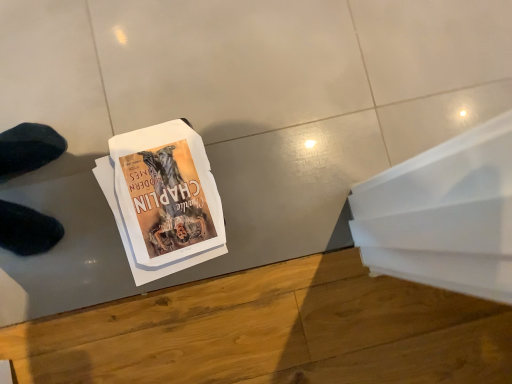
Locate an element on the screen. The width and height of the screenshot is (512, 384). vacant area on top of matte paper book at center (from a real-world perspective) is located at coordinates (172, 198).